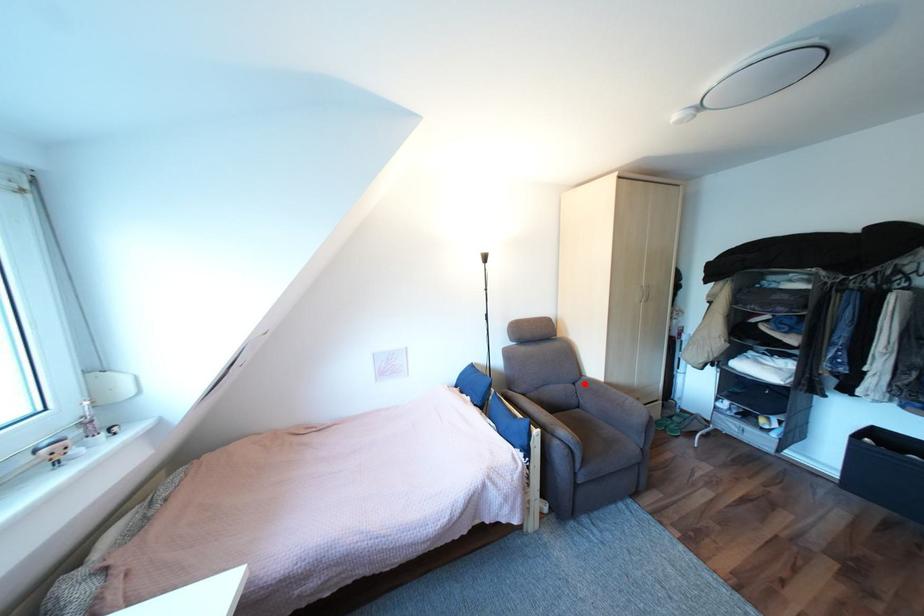
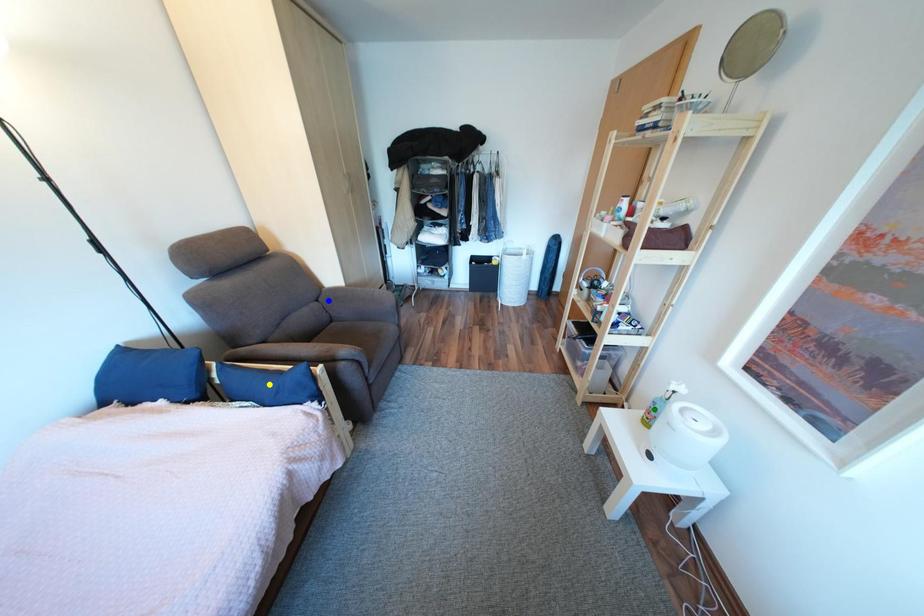
Question: I am providing you with two images of the same scene from different viewpoints. A red point is marked on the first image. You are given multiple points on the second image. Which spot in image 2 lines up with the point in image 1?

Choices:
 (A) blue point
 (B) yellow point
 (C) green point

Answer: (A)